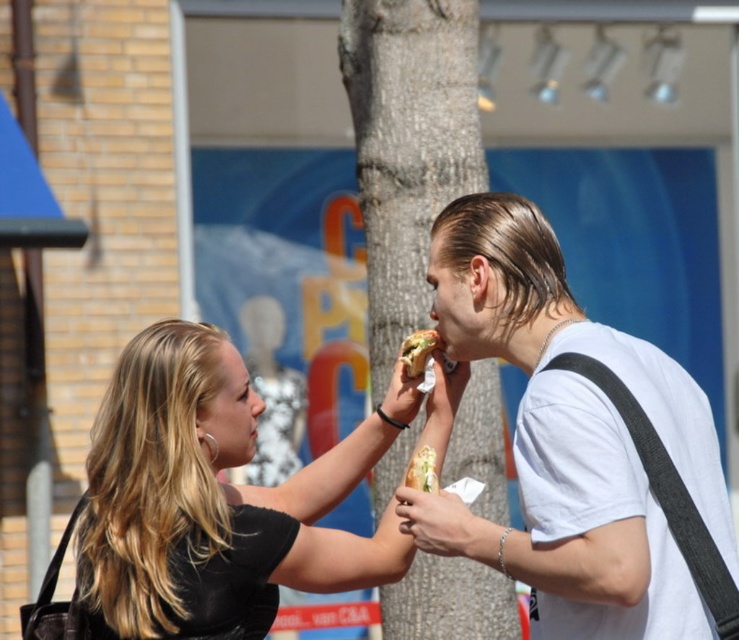
Question: From the image, what is the correct spatial relationship of black matte shirt at center in relation to white bread sandwich at center?

Choices:
 (A) below
 (B) above

Answer: (A)

Question: Where is green textured tree trunk at center located in relation to smooth white hand at center in the image?

Choices:
 (A) right
 (B) left

Answer: (B)

Question: Estimate the real-world distances between objects in this image. Which object is farther from the smooth white hand at center?

Choices:
 (A) green textured tree trunk at center
 (B) white matte shirt at right
 (C) white bread sandwich at center
 (D) shiny golden sandwich at center

Answer: (A)

Question: Which of the following is the closest to the observer?

Choices:
 (A) smooth white hand at center
 (B) black matte shirt at center

Answer: (A)

Question: Does smooth white hand at center lie behind white bread sandwich at center?

Choices:
 (A) yes
 (B) no

Answer: (B)

Question: Which object appears closest to the camera in this image?

Choices:
 (A) shiny golden sandwich at center
 (B) white bread sandwich at center
 (C) black matte shirt at center

Answer: (C)